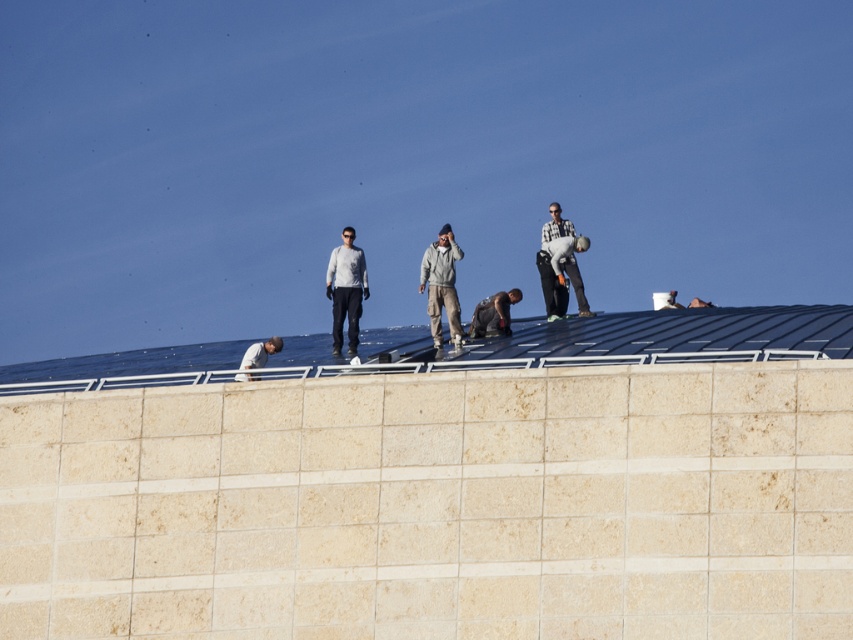
Question: Which point is closer to the camera?

Choices:
 (A) (473, 332)
 (B) (453, 241)
 (C) (276, 348)
 (D) (352, 244)

Answer: (C)

Question: Is light gray sweater at center positioned before gray fleece jacket at center?

Choices:
 (A) no
 (B) yes

Answer: (A)

Question: Does light gray sweater at center have a smaller size compared to denim pants at center?

Choices:
 (A) no
 (B) yes

Answer: (A)

Question: From the image, what is the correct spatial relationship of light gray sweater at center in relation to gray fleece jacket at center?

Choices:
 (A) above
 (B) below

Answer: (B)

Question: Which point appears farthest from the camera in this image?

Choices:
 (A) (553, 296)
 (B) (497, 301)
 (C) (260, 358)
 (D) (431, 298)

Answer: (A)

Question: Which point is farther to the camera?

Choices:
 (A) (262, 362)
 (B) (498, 332)

Answer: (B)